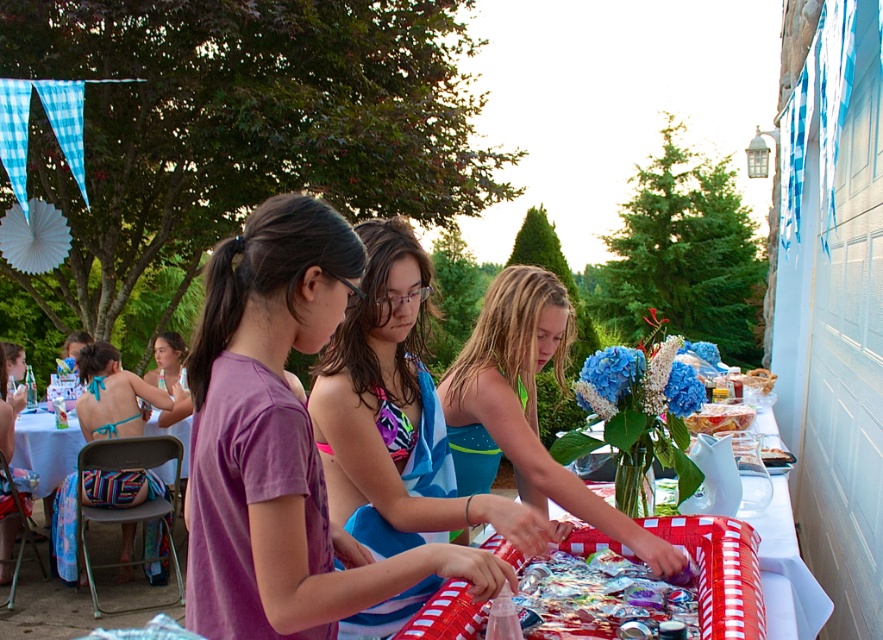
How distant is blonde hair at center from shiny plastic tray at right?

blonde hair at center and shiny plastic tray at right are 1.38 meters apart.

Can you confirm if blonde hair at center is shorter than shiny plastic tray at right?

Incorrect, blonde hair at center's height does not fall short of shiny plastic tray at right's.

Locate an element on the screen. This screenshot has width=883, height=640. blonde hair at center is located at coordinates [x=525, y=406].

Is red and white striped tray at center smaller than shiny plastic tray at right?

Actually, red and white striped tray at center might be larger than shiny plastic tray at right.

What do you see at coordinates (770, 598) in the screenshot? I see `red and white striped tray at center` at bounding box center [770, 598].

Is point (570, 536) behind point (751, 420)?

No.

Where is `red and white striped tray at center`? red and white striped tray at center is located at coordinates (770, 598).

Between shiny metallic foil at center and shiny plastic tray at right, which one appears on the right side from the viewer's perspective?

shiny plastic tray at right is more to the right.

Who is higher up, shiny metallic foil at center or shiny plastic tray at right?

shiny plastic tray at right

Image resolution: width=883 pixels, height=640 pixels. Identify the location of shiny metallic foil at center. (598, 598).

You are a GUI agent. You are given a task and a screenshot of the screen. Output one action in this format:
    pyautogui.click(x=<x>, y=<y>)
    Task: Click on the shiny metallic foil at center
    
    Given the screenshot: What is the action you would take?
    pyautogui.click(x=598, y=598)